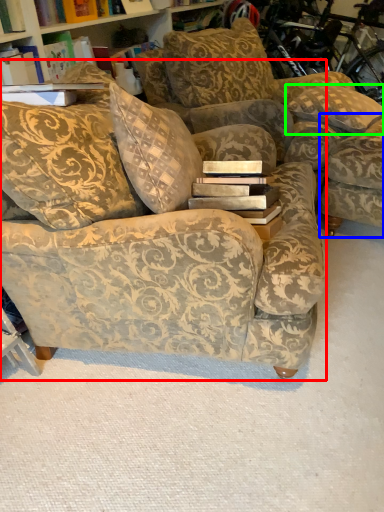
Question: Which is nearer to the studio couch (highlighted by a red box)? swivel chair (highlighted by a blue box) or pillow (highlighted by a green box).

Choices:
 (A) swivel chair
 (B) pillow

Answer: (A)